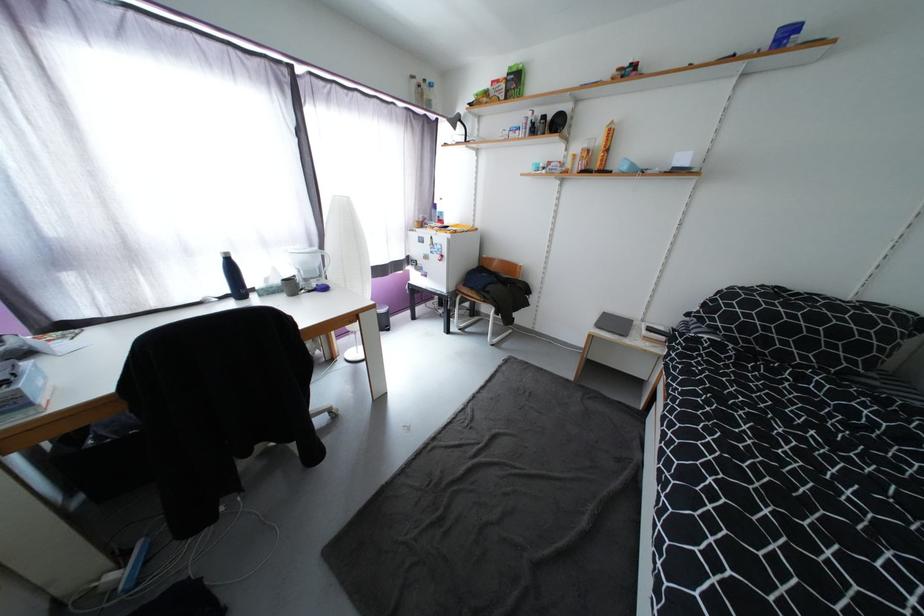
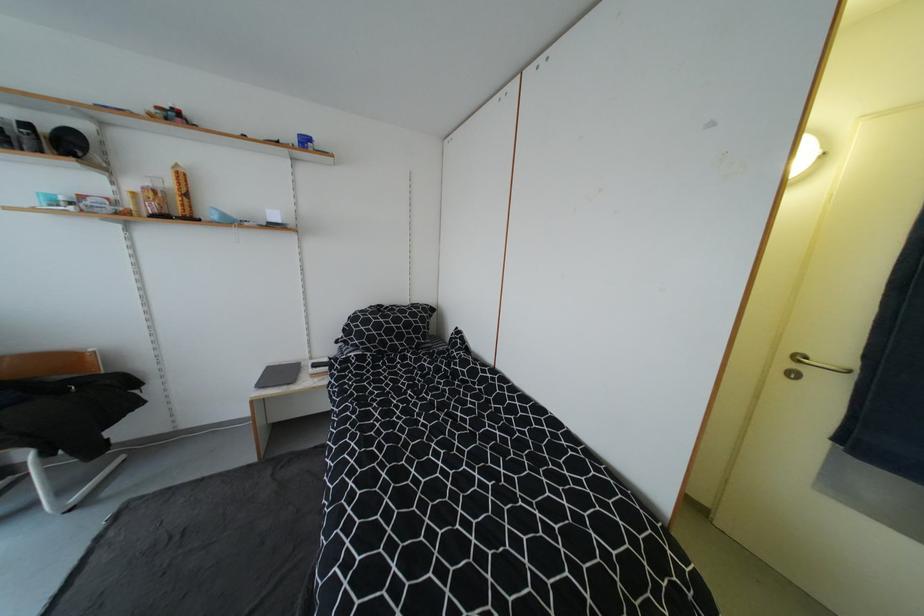
Locate, in the second image, the point that corresponds to [604,143] in the first image.

(176, 185)